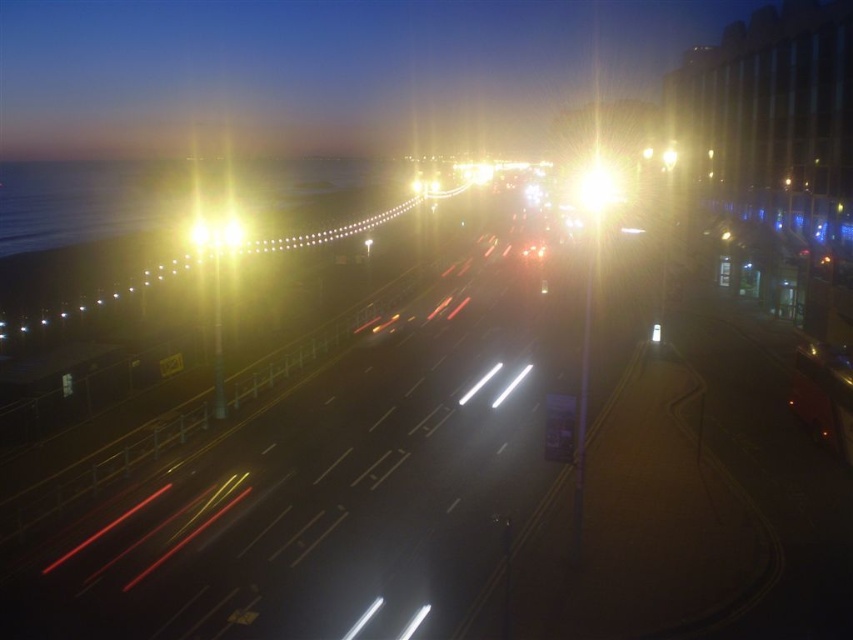
You are a photographer standing at the edge of the promenade. You notice the metallic orange car at lower right and the bright yellow light at center in your viewfinder. Which object appears larger in your photo?

The bright yellow light at center appears larger in the photo because the metallic orange car at lower right has a smaller size compared to bright yellow light at center.

You are a photographer trying to capture the bright metallic streetlight at center and the bright yellow light at center in your shot. Which of the two lights is farther away from the camera?

The bright yellow light at center is farther away from the camera because it is positioned behind the bright metallic streetlight at center.